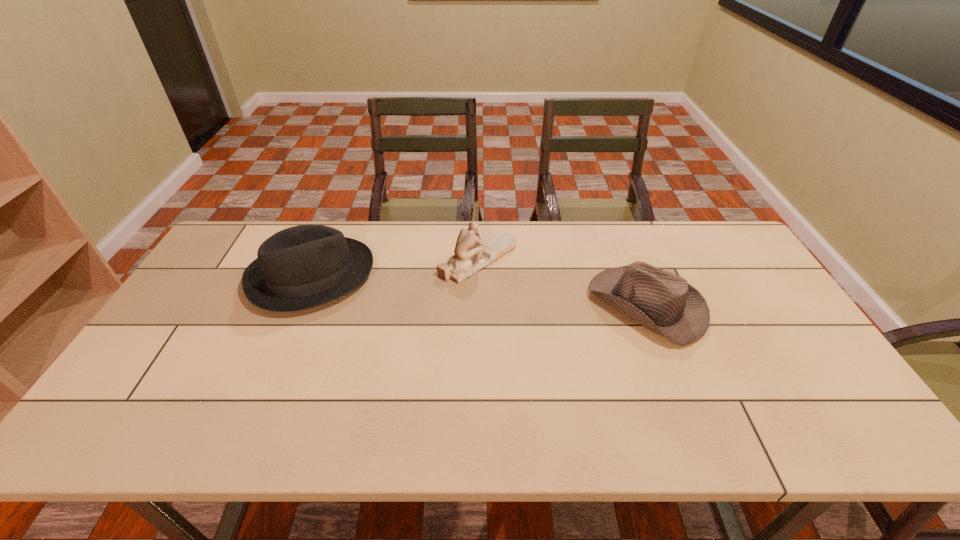
Find the location of a particular element. The image size is (960, 540). object present at the left edge is located at coordinates (301, 267).

This screenshot has height=540, width=960. What are the coordinates of `object present at the far left corner` in the screenshot? It's located at (301, 267).

The image size is (960, 540). Identify the location of vacant position at the far edge of the desktop. pyautogui.click(x=627, y=259).

You are a GUI agent. You are given a task and a screenshot of the screen. Output one action in this format:
    pyautogui.click(x=<x>, y=<y>)
    Task: Click on the free space at the near edge of the desktop
    This screenshot has height=540, width=960.
    Given the screenshot: What is the action you would take?
    pyautogui.click(x=253, y=412)

Where is `vacant area at the left edge of the desktop`? This screenshot has width=960, height=540. vacant area at the left edge of the desktop is located at coordinates (124, 407).

Where is `vacant region at the right edge`? The width and height of the screenshot is (960, 540). vacant region at the right edge is located at coordinates (786, 402).

Where is `free region at the far left corner of the desktop`? Image resolution: width=960 pixels, height=540 pixels. free region at the far left corner of the desktop is located at coordinates (252, 232).

In the image, there is a desktop. Where is `vacant space at the far right corner`? This screenshot has width=960, height=540. vacant space at the far right corner is located at coordinates (732, 245).

Where is `vacant space at the near right corner of the desktop`? vacant space at the near right corner of the desktop is located at coordinates (847, 415).

At what (x,y) coordinates should I click in order to perform the action: click on free space between the right fedora and the second object from right to left. Please return your answer as a coordinate pair (x, y). This screenshot has width=960, height=540. Looking at the image, I should click on (563, 282).